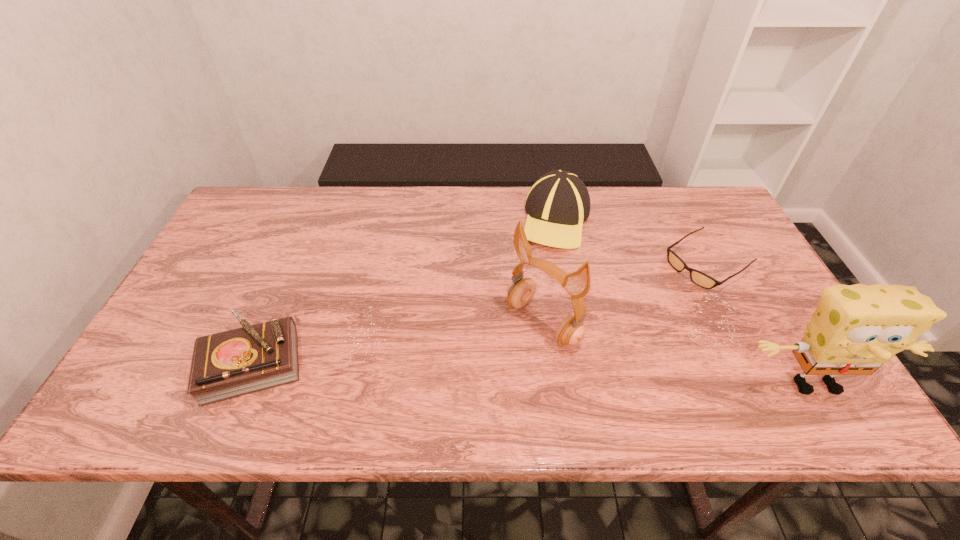
Image resolution: width=960 pixels, height=540 pixels. I want to click on the fourth tallest object, so click(229, 364).

Image resolution: width=960 pixels, height=540 pixels. In order to click on diary in this screenshot , I will do `click(229, 364)`.

Find the location of a particular element. sponge is located at coordinates (856, 329).

At what (x,y) coordinates should I click in order to perform the action: click on sunglasses. Please return your answer as a coordinate pair (x, y). Image resolution: width=960 pixels, height=540 pixels. Looking at the image, I should click on (699, 278).

Find the location of `the third tallest object`. the third tallest object is located at coordinates (558, 203).

The height and width of the screenshot is (540, 960). What are the coordinates of `earphone` in the screenshot? It's located at (571, 331).

Locate an element on the screen. free region located 0.230m on the right of the leftmost object is located at coordinates (407, 363).

Locate an element on the screen. Image resolution: width=960 pixels, height=540 pixels. free region located on the front-facing side of the sunglasses is located at coordinates (601, 333).

Identify the location of free spot located on the front-facing side of the sunglasses. The image size is (960, 540). (653, 298).

The image size is (960, 540). Find the location of `free space located on the front-facing side of the sunglasses`. free space located on the front-facing side of the sunglasses is located at coordinates (577, 348).